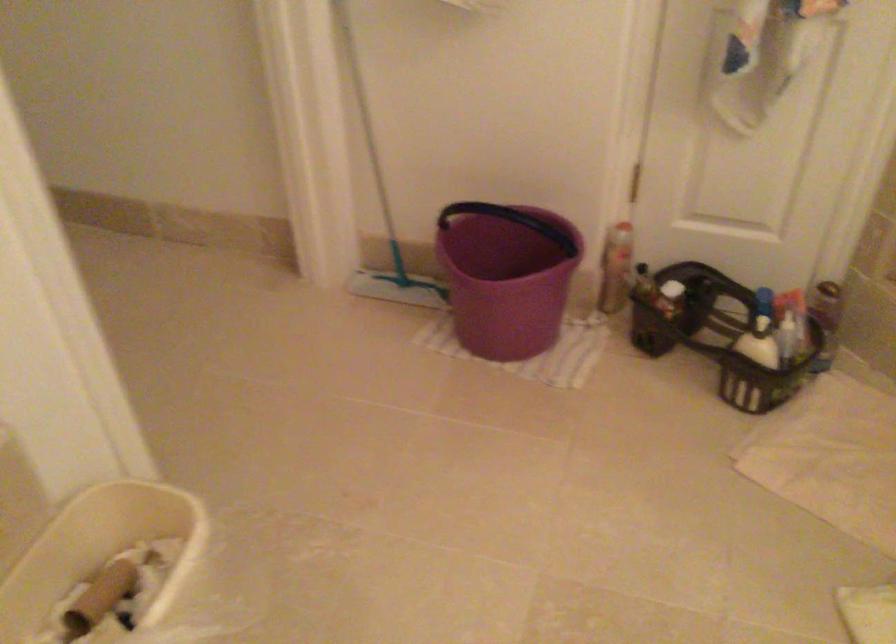
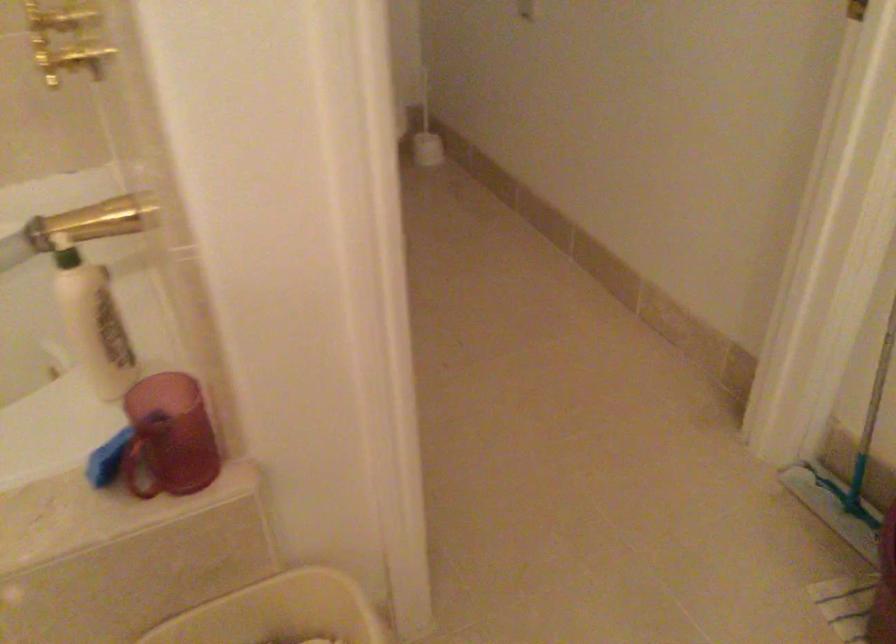
Locate, in the second image, the point that corresponds to [391,220] in the first image.

(866, 431)